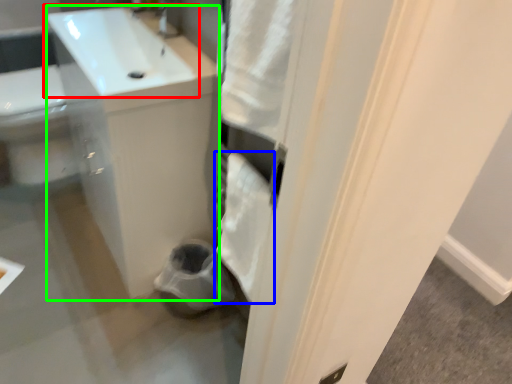
Question: Which is farther away from sink (highlighted by a red box)? bath towel (highlighted by a blue box) or counter top (highlighted by a green box)?

Choices:
 (A) bath towel
 (B) counter top

Answer: (A)